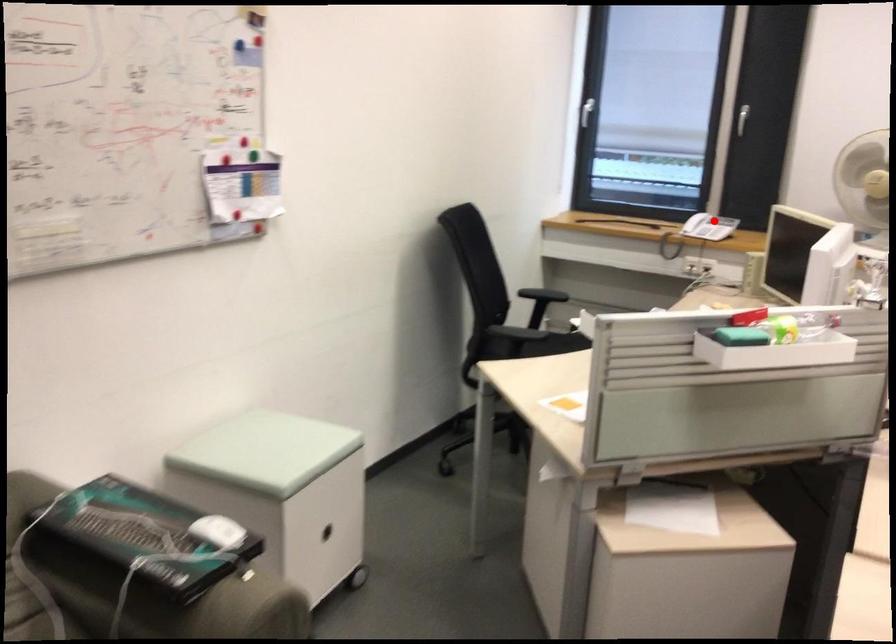
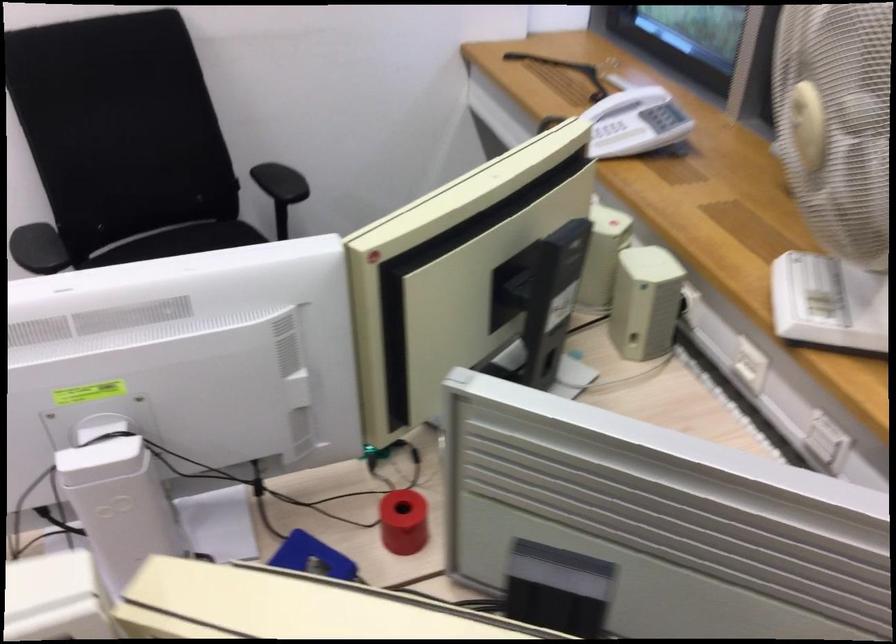
Where in the second image is the point corresponding to the highlighted location from the first image?

(634, 122)